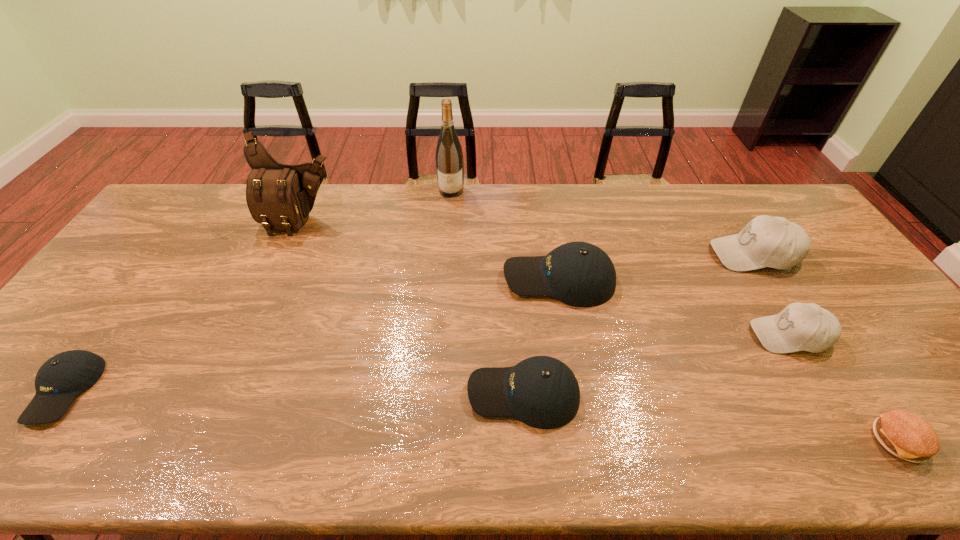
The image size is (960, 540). I want to click on brown wine bottle, so click(449, 157).

You are a GUI agent. You are given a task and a screenshot of the screen. Output one action in this format:
    pyautogui.click(x=<x>, y=<y>)
    Task: Click on the wine bottle
    
    Given the screenshot: What is the action you would take?
    [449, 157]

The height and width of the screenshot is (540, 960). Identify the location of shoulder bag. (279, 196).

Where is `the second tallest object`? the second tallest object is located at coordinates (279, 196).

You are a GUI agent. You are given a task and a screenshot of the screen. Output one action in this format:
    pyautogui.click(x=<x>, y=<y>)
    Task: Click on the bigger gray baseball cap
    
    Given the screenshot: What is the action you would take?
    pyautogui.click(x=766, y=241)

The image size is (960, 540). Find the location of `the farthest blue baseball cap`. the farthest blue baseball cap is located at coordinates (580, 274).

Image resolution: width=960 pixels, height=540 pixels. I want to click on the nearer gray baseball cap, so click(799, 326).

Find the location of a particular element. This screenshot has height=540, width=960. the second biggest blue baseball cap is located at coordinates (542, 392).

Where is `the smallest blue baseball cap`? Image resolution: width=960 pixels, height=540 pixels. the smallest blue baseball cap is located at coordinates (63, 377).

In order to click on the leftmost blue baseball cap in this screenshot , I will do `click(63, 377)`.